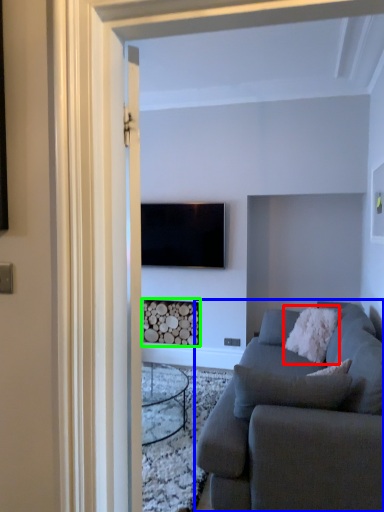
Question: Which is farther away from pillow (highlighted by a red box)? studio couch (highlighted by a blue box) or fireplace (highlighted by a green box)?

Choices:
 (A) studio couch
 (B) fireplace

Answer: (B)